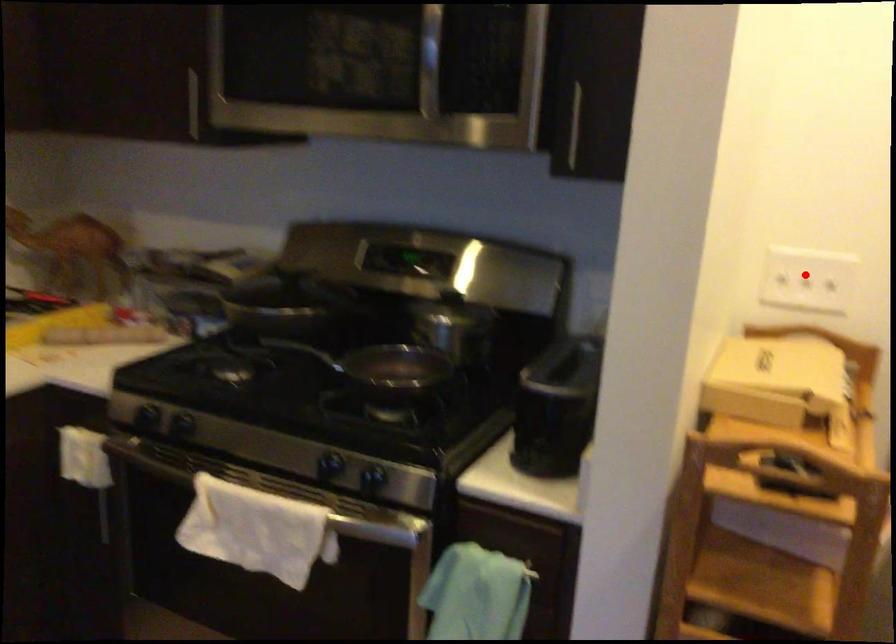
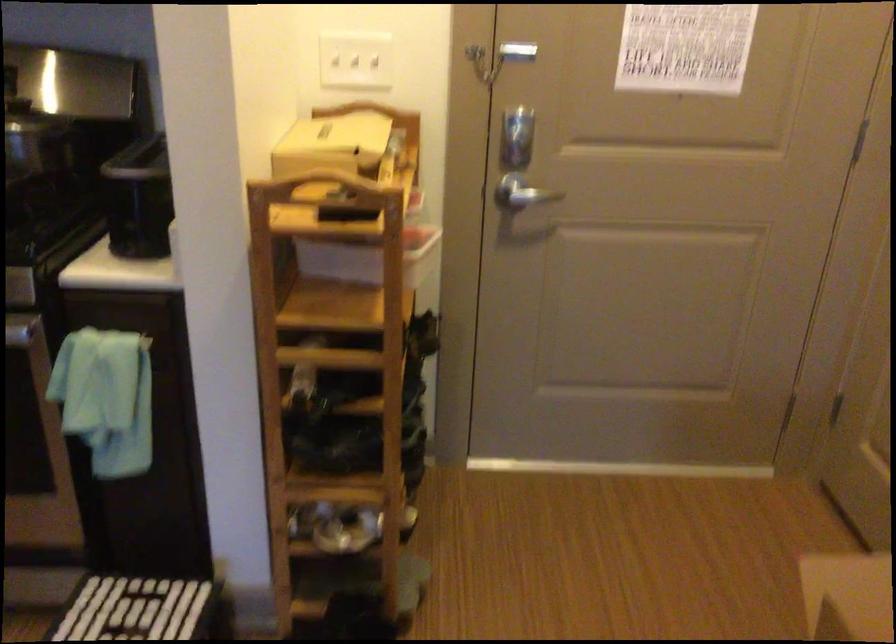
Where in the second image is the point corresponding to the highlighted location from the first image?

(356, 61)